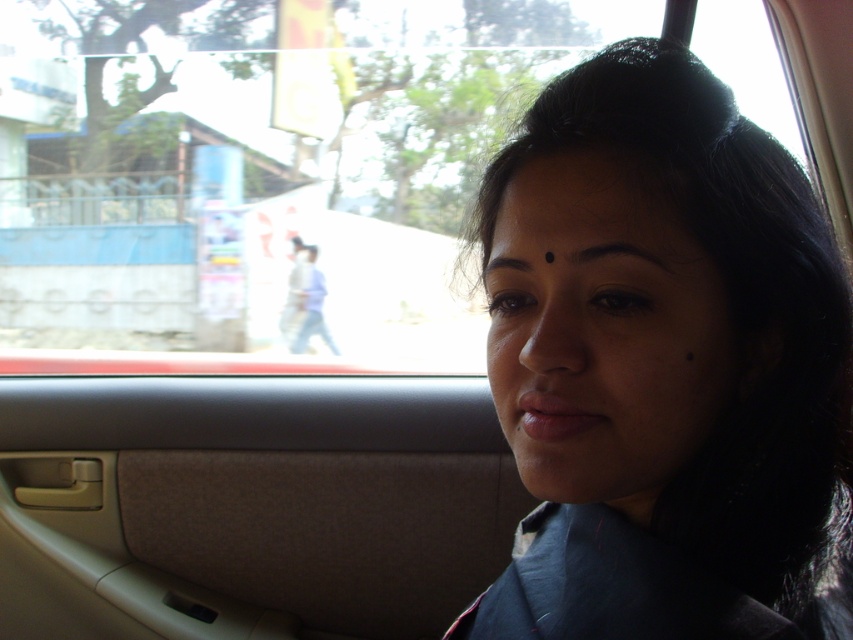
You are a passenger in a car and want to know which object is nearer to you between the dark blue fabric at center and the black smooth forehead at upper center. Based on the scene description, which one is closer?

The dark blue fabric at center is closer to the viewer than the black smooth forehead at upper center according to the description.

You are a fashion designer observing the scene. You notice the dark blue fabric at center and the black smooth forehead at upper center. Which object in the scene is bigger?

The dark blue fabric at center has a larger size compared to the black smooth forehead at upper center, so the dark blue fabric at center is bigger.